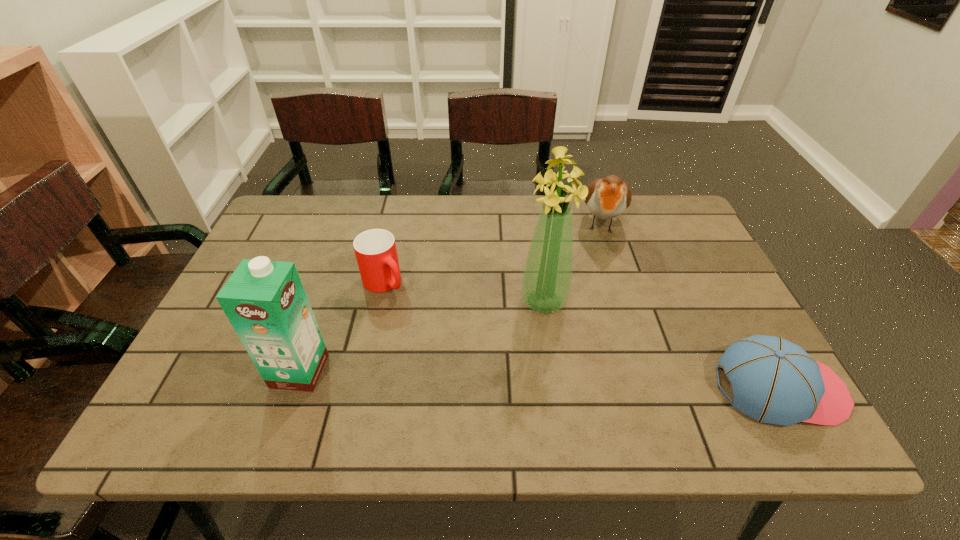
Image resolution: width=960 pixels, height=540 pixels. I want to click on blank area in the image that satisfies the following two spatial constraints: 1. on the front side of the cup; 2. on the front-facing side of the baseball cap, so click(361, 388).

This screenshot has width=960, height=540. In order to click on free location that satisfies the following two spatial constraints: 1. on the back side of the carton; 2. on the left side of the third tallest object in this screenshot , I will do `click(351, 222)`.

Identify the location of blank area in the image that satisfies the following two spatial constraints: 1. on the back side of the fourth shortest object; 2. on the left side of the bird. (351, 222).